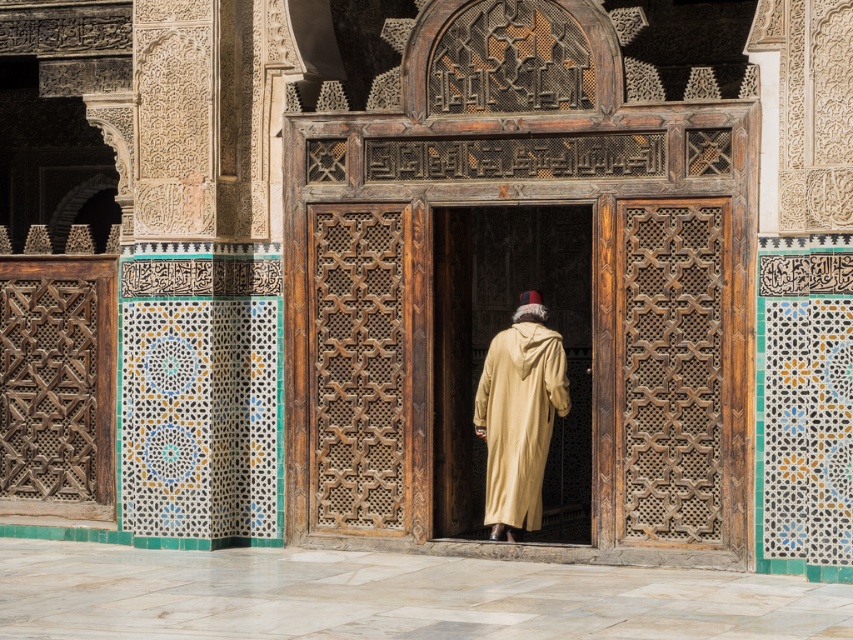
Question: Among these points, which one is nearest to the camera?

Choices:
 (A) (556, 436)
 (B) (407, 328)

Answer: (B)

Question: Is wooden door at center thinner than beige woolen robe at center?

Choices:
 (A) no
 (B) yes

Answer: (B)

Question: Does wooden carved door at center appear on the right side of beige woolen robe at center?

Choices:
 (A) no
 (B) yes

Answer: (B)

Question: Which point is closer to the camera?

Choices:
 (A) (589, 417)
 (B) (498, 408)

Answer: (B)

Question: Considering the real-world distances, which object is farthest from the beige woolen robe at center?

Choices:
 (A) wooden carved door at center
 (B) wooden door at center

Answer: (B)

Question: Does wooden door at center appear under beige woolen robe at center?

Choices:
 (A) no
 (B) yes

Answer: (A)